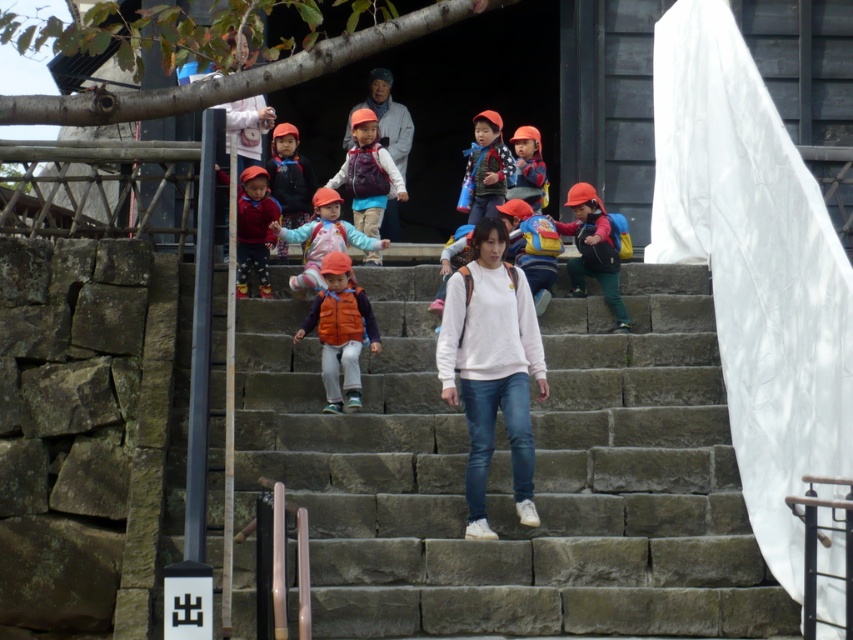
You are a photographer positioned at the bottom of the stone steps. You want to take a photo of the matte red jacket at center and the matte orange vest at center without any obstructions. Since both are at the center, which one should you focus on first to ensure both are visible?

The matte red jacket at center is in front of the matte orange vest at center, so you should focus on the matte orange vest at center first to ensure it is not blocked by the matte red jacket at center.

You are a photographer positioned at the bottom of the stone steps. You want to capture a photo of the orange fabric jacket at center and the matte orange vest at center so that both are clearly visible. Which object should you focus on first to ensure it appears sharp in the photo?

You should focus on the matte orange vest at center first because it is higher up than the orange fabric jacket at center, which is located below it. By focusing on the vest, you can ensure both objects are in focus as the jacket is below the vest.